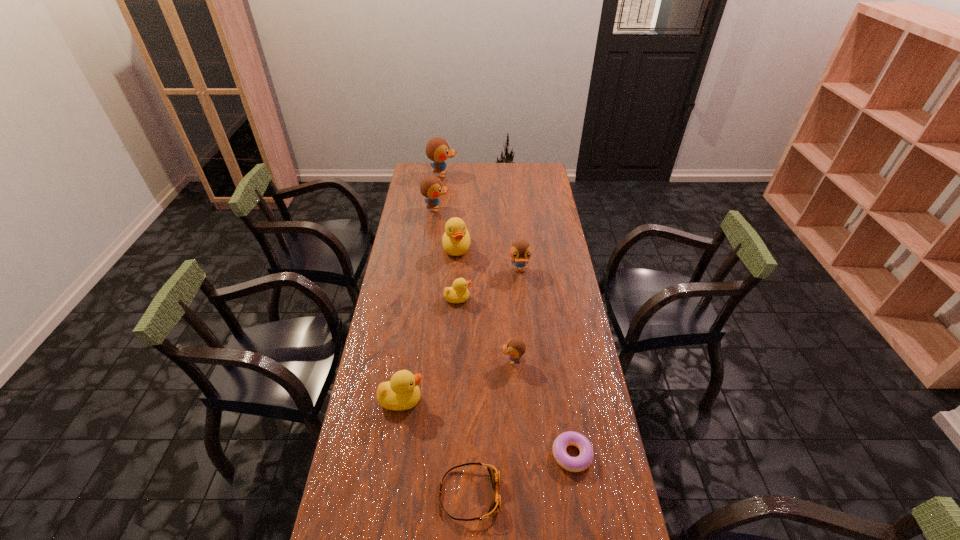
At what (x,y) coordinates should I click in order to perform the action: click on free area in between the tallest duck and the third farthest object. Please return your answer as a coordinate pair (x, y). This screenshot has height=540, width=960. Looking at the image, I should click on (450, 211).

I want to click on unoccupied position between the doughnut and the biggest blue duck, so click(508, 315).

Identify which object is the fifth nearest to the second nearest yellow duck. Please provide its 2D coordinates. Your answer should be formatted as a tuple, i.e. [(x, y)], where the tuple contains the x and y coordinates of a point satisfying the conditions above.

[(431, 187)]

Identify the location of object that is the third closest one to the farthest duck. (520, 251).

This screenshot has width=960, height=540. Find the location of `the sixth closest duck to the nearest yellow duck`. the sixth closest duck to the nearest yellow duck is located at coordinates (437, 149).

Locate an element on the screen. This screenshot has height=540, width=960. duck that stands as the fourth closest to the seventh nearest object is located at coordinates (437, 149).

Select which blue duck appears as the fourth closest to the doughnut. Please provide its 2D coordinates. Your answer should be formatted as a tuple, i.e. [(x, y)], where the tuple contains the x and y coordinates of a point satisfying the conditions above.

[(437, 149)]

You are a GUI agent. You are given a task and a screenshot of the screen. Output one action in this format:
    pyautogui.click(x=<x>, y=<y>)
    Task: Click on the blue duck that is the nearest to the goggles
    
    Given the screenshot: What is the action you would take?
    pyautogui.click(x=515, y=348)

Identify the location of yellow duck that stands as the closest to the second nearest yellow duck. This screenshot has width=960, height=540. (456, 240).

Identify which yellow duck is the second closest to the leftmost yellow duck. Please provide its 2D coordinates. Your answer should be formatted as a tuple, i.e. [(x, y)], where the tuple contains the x and y coordinates of a point satisfying the conditions above.

[(456, 240)]